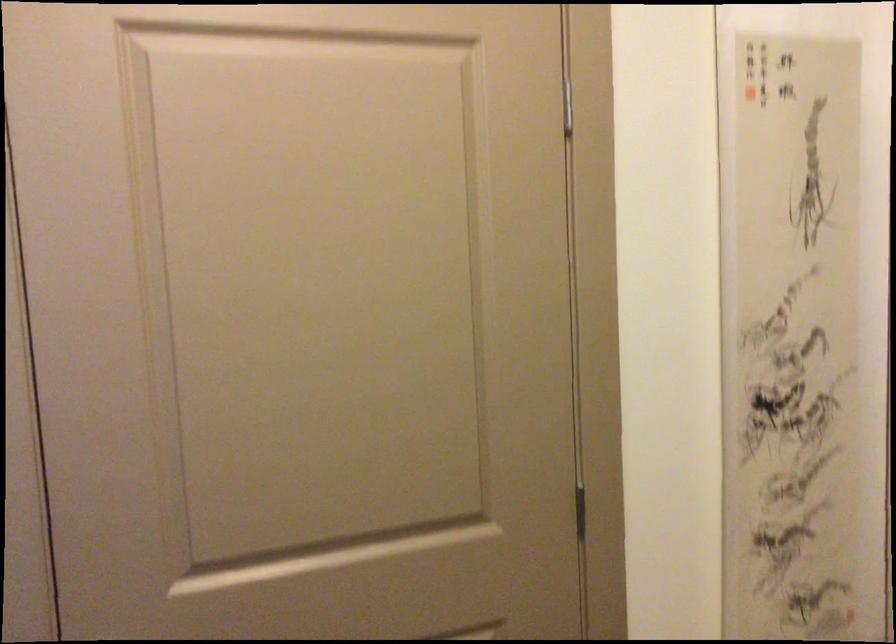
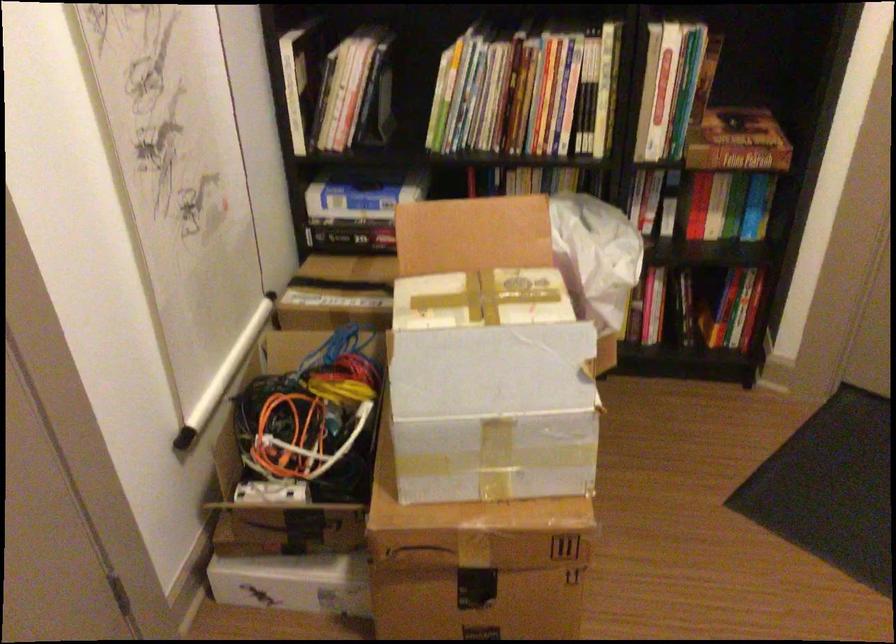
The first image is from the beginning of the video and the second image is from the end. How did the camera likely rotate when shooting the video?

The camera's rotation is toward right-down.